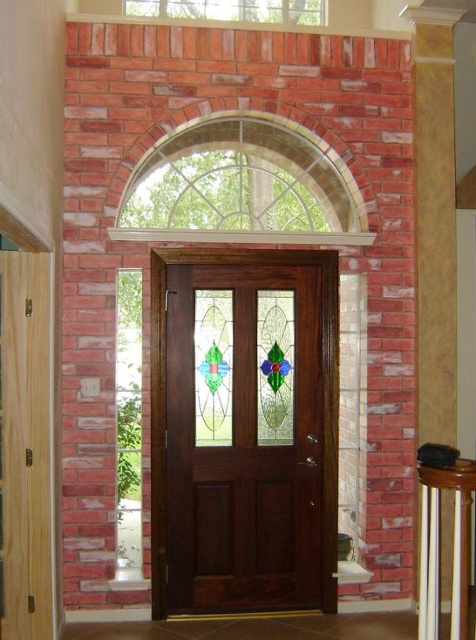
From the picture: You are standing at the entrance and want to reach the clear glass window at upper center from the white wood balustrade at lower right. Can you walk directly to it without any obstacles?

The white wood balustrade at lower right is 3.43 meters away from the clear glass window at upper center. Since the distance is clear, you can walk directly to it without any obstacles.